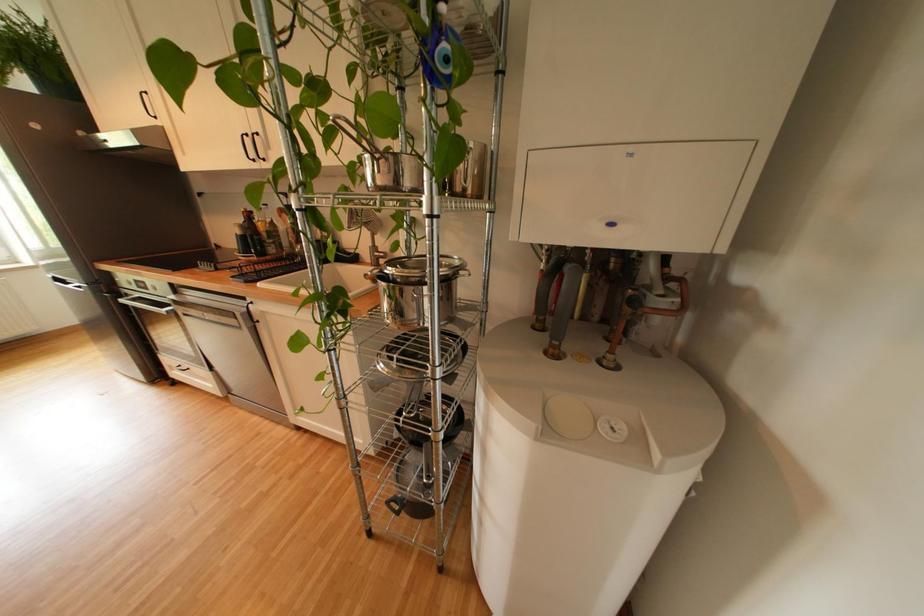
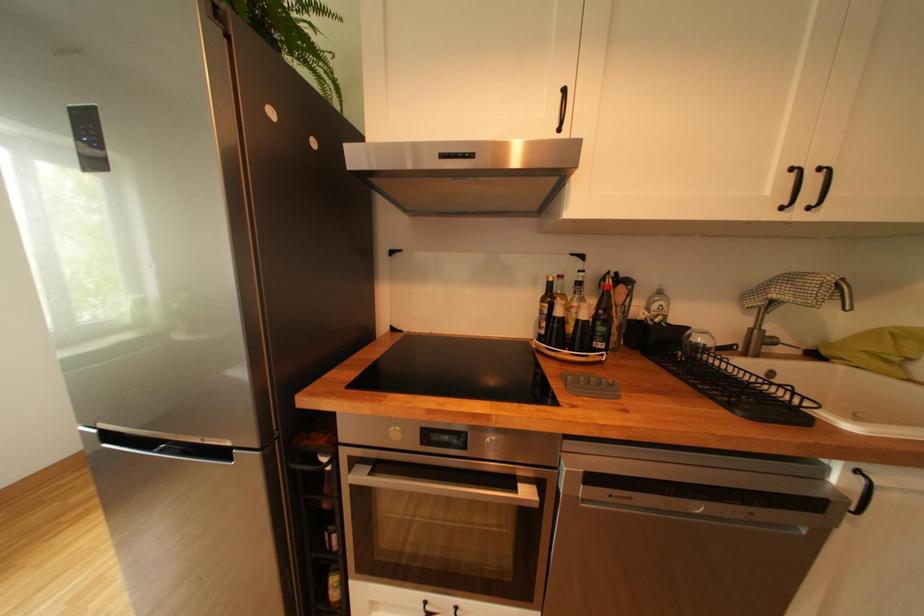
The images are taken continuously from a first-person perspective. In which direction are you moving?

The movement direction of the cameraman is left, forward.